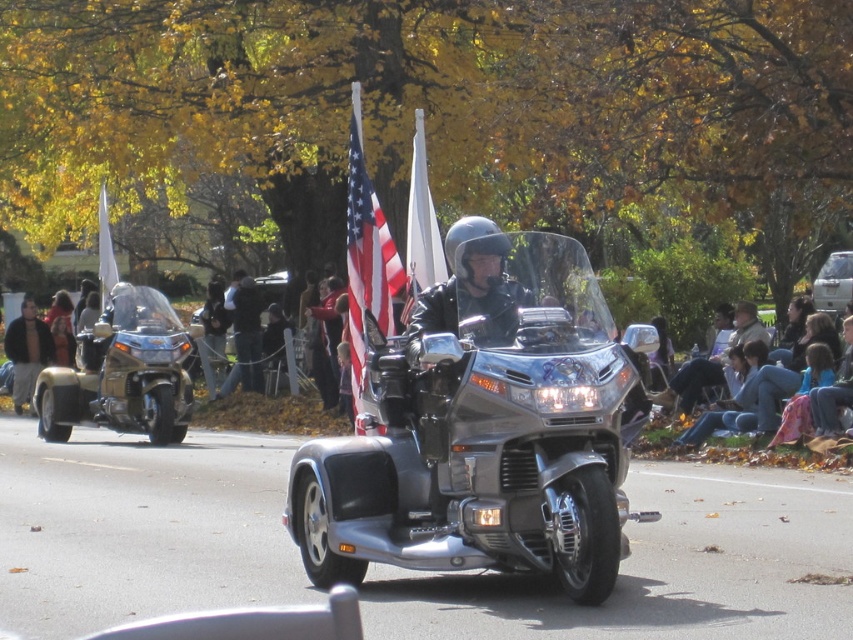
Question: From the image, what is the correct spatial relationship of polished chrome trike at center in relation to american flag at center?

Choices:
 (A) right
 (B) left

Answer: (A)

Question: Based on their relative distances, which object is nearer to the dark brown leather jacket at left?

Choices:
 (A) white fabric flag at center
 (B) gold metallic trike at left
 (C) white fabric flag at upper left
 (D) polished chrome trike at center

Answer: (C)

Question: Where is denim jacket at lower right located in relation to white fabric flag at center in the image?

Choices:
 (A) above
 (B) below

Answer: (B)

Question: Which point is farther to the camera?

Choices:
 (A) (428, 198)
 (B) (180, 436)
 (C) (4, 339)
 (D) (602, 561)

Answer: (C)

Question: Is denim jacket at lower right bigger than dark brown leather jacket at left?

Choices:
 (A) yes
 (B) no

Answer: (A)

Question: Which point is closer to the camera?

Choices:
 (A) (125, 426)
 (B) (366, 225)
 (C) (100, 269)

Answer: (B)